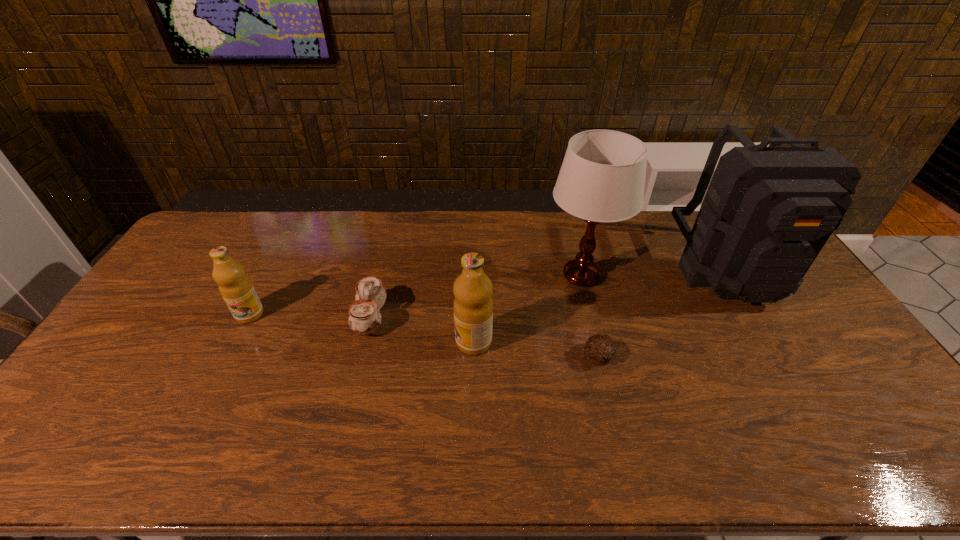
In order to click on vacant space at the far edge of the desktop in this screenshot , I will do (x=512, y=248).

You are a GUI agent. You are given a task and a screenshot of the screen. Output one action in this format:
    pyautogui.click(x=<x>, y=<y>)
    Task: Click on the free region at the far left corner of the desktop
    The image size is (960, 540).
    Given the screenshot: What is the action you would take?
    pyautogui.click(x=218, y=214)

Locate an element on the screen. This screenshot has height=540, width=960. vacant space in between the table lamp and the rightmost object is located at coordinates (656, 273).

This screenshot has width=960, height=540. I want to click on vacant area between the table lamp and the muffin, so click(x=589, y=316).

Find the location of a particular element. The image size is (960, 540). vacant area between the taller olive oil and the table lamp is located at coordinates (528, 309).

Locate an element on the screen. Image resolution: width=960 pixels, height=540 pixels. vacant space that is in between the table lamp and the right olive oil is located at coordinates (528, 309).

Where is `vacant region between the table lamp and the muffin`? This screenshot has width=960, height=540. vacant region between the table lamp and the muffin is located at coordinates coord(589,316).

Find the location of a particular element. This screenshot has height=540, width=960. free area in between the left olive oil and the table lamp is located at coordinates (416, 295).

What are the coordinates of `vacant space that is in between the table lamp and the rightmost object` in the screenshot? It's located at (656, 273).

This screenshot has width=960, height=540. In order to click on the fifth closest object to the table lamp in this screenshot , I will do `click(236, 288)`.